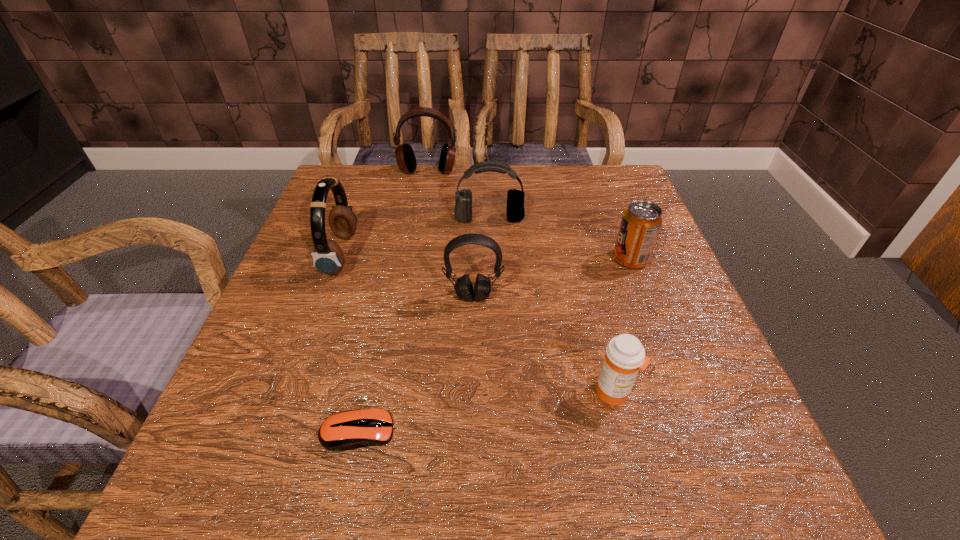
Identify the location of soda can that is positioned at the right edge. This screenshot has width=960, height=540. (641, 222).

Image resolution: width=960 pixels, height=540 pixels. I want to click on medicine at the right edge, so click(x=625, y=355).

You are a GUI agent. You are given a task and a screenshot of the screen. Output one action in this format:
    pyautogui.click(x=<x>, y=<y>)
    Task: Click on the object that is positioned at the near left corner
    This screenshot has width=960, height=540.
    Given the screenshot: What is the action you would take?
    pyautogui.click(x=346, y=430)

Identify the location of vacant space at the far edge of the desktop. The height and width of the screenshot is (540, 960). (417, 190).

Where is `blank space at the near edge of the desktop`? This screenshot has width=960, height=540. blank space at the near edge of the desktop is located at coordinates (471, 505).

Locate an element on the screen. This screenshot has width=960, height=540. vacant point at the left edge is located at coordinates (260, 360).

I want to click on vacant space at the right edge of the desktop, so click(x=657, y=272).

In the image, there is a desktop. Identify the location of vacant region at the far left corner. click(347, 176).

Find the location of `vacant space at the near left corner of the desktop`. vacant space at the near left corner of the desktop is located at coordinates (303, 456).

Locate an element on the screen. This screenshot has width=960, height=540. vacant space at the far right corner is located at coordinates pos(577,184).